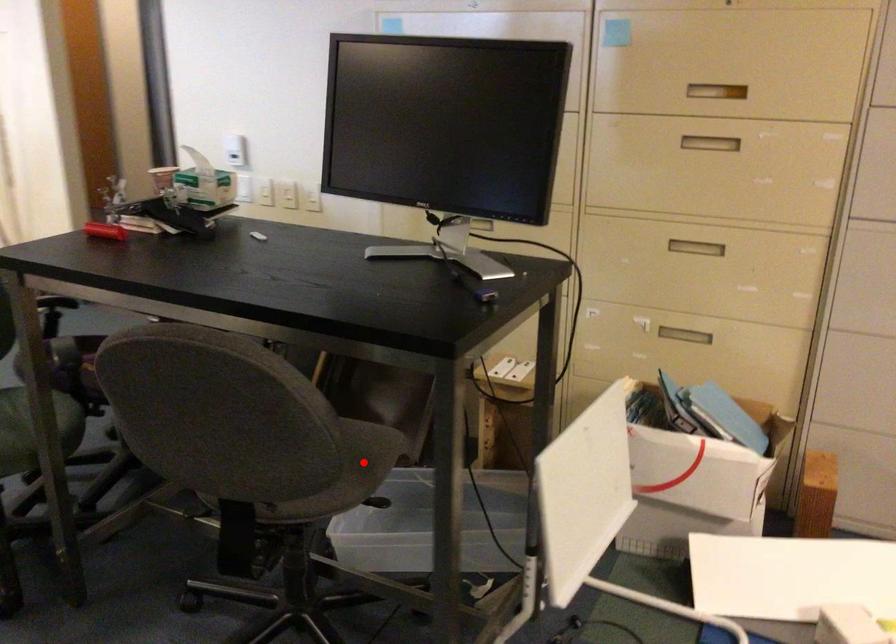
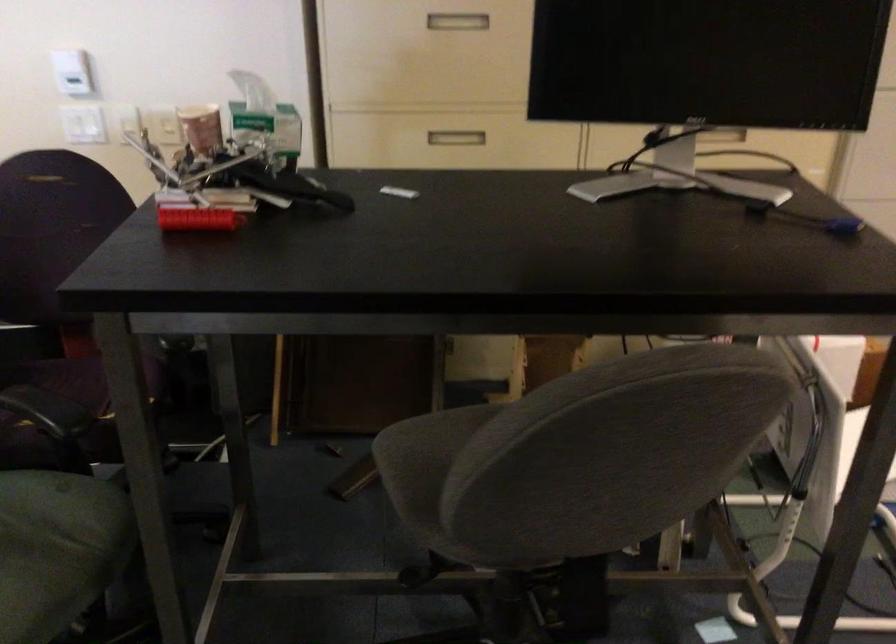
Question: I am providing you with two images of the same scene from different viewpoints. A red point is marked on the first image. Can you still see the location of the red point in image 2?

Choices:
 (A) Yes
 (B) No

Answer: (B)